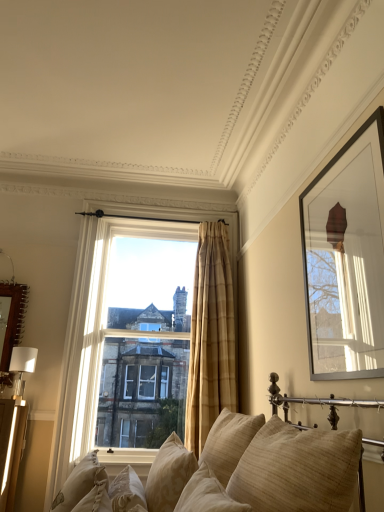
Find the location of a particular element. Image resolution: width=384 pixels, height=512 pixels. free space above wooden mirror at left, which is the 1th picture frame in back-to-front order (from a real-world perspective) is located at coordinates (14, 249).